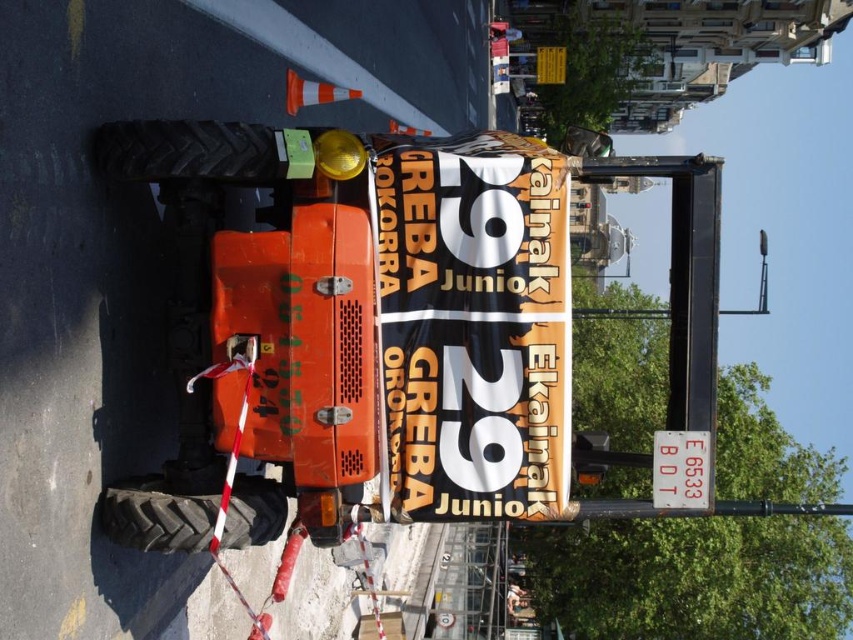
You are a city planner reviewing the construction site. You need to determine if the orange vinyl banner at center can be placed horizontally on the black rubber tire at left without overlapping. Based on their widths, can it fit?

The orange vinyl banner at center has a width less than the black rubber tire at left, so it can be placed horizontally on the black rubber tire at left without overlapping.

You are a delivery driver who needs to park your vehicle between the rubber tread tire at lower left and the black rubber tire at left. Since you want to ensure your vehicle doesn not hit any obstacles, can you tell me which tire is taller so you can position accordingly?

The rubber tread tire at lower left is taller than the black rubber tire at left, so you should position your vehicle away from the rubber tread tire at lower left to avoid hitting it.